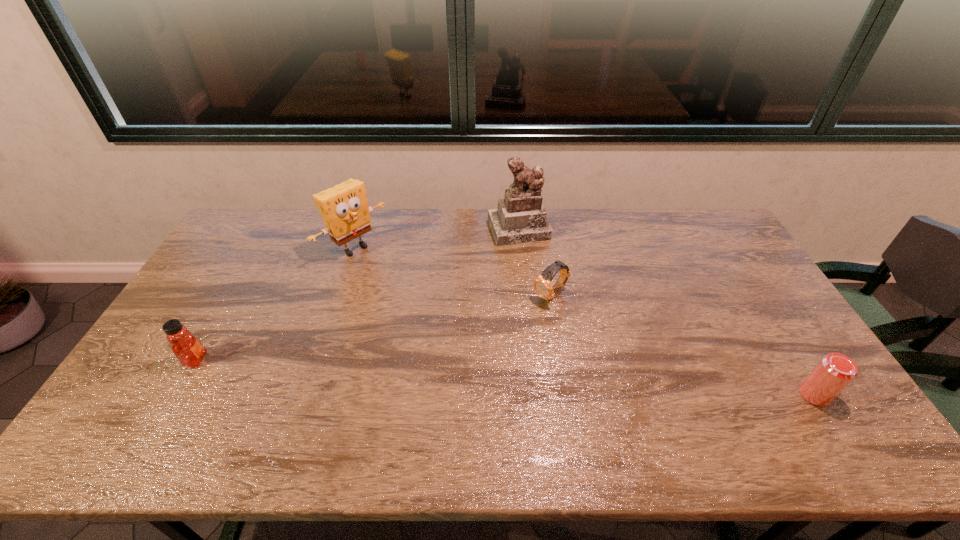
Identify which object is located as the fourth nearest to the tallest object. Please provide its 2D coordinates. Your answer should be formatted as a tuple, i.e. [(x, y)], where the tuple contains the x and y coordinates of a point satisfying the conditions above.

[(189, 351)]

The width and height of the screenshot is (960, 540). I want to click on the second closest object to the third farthest object, so click(x=344, y=208).

Locate an element on the screen. free space that satisfies the following two spatial constraints: 1. on the front side of the second tallest object; 2. on the right side of the beer can is located at coordinates (307, 395).